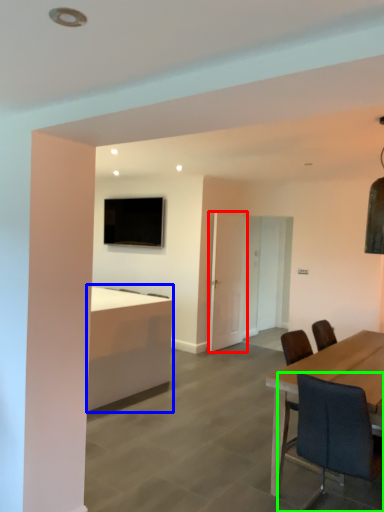
Question: Considering the real-world distances, which object is closest to glass door (highlighted by a red box)? desk (highlighted by a blue box) or chair (highlighted by a green box).

Choices:
 (A) desk
 (B) chair

Answer: (A)